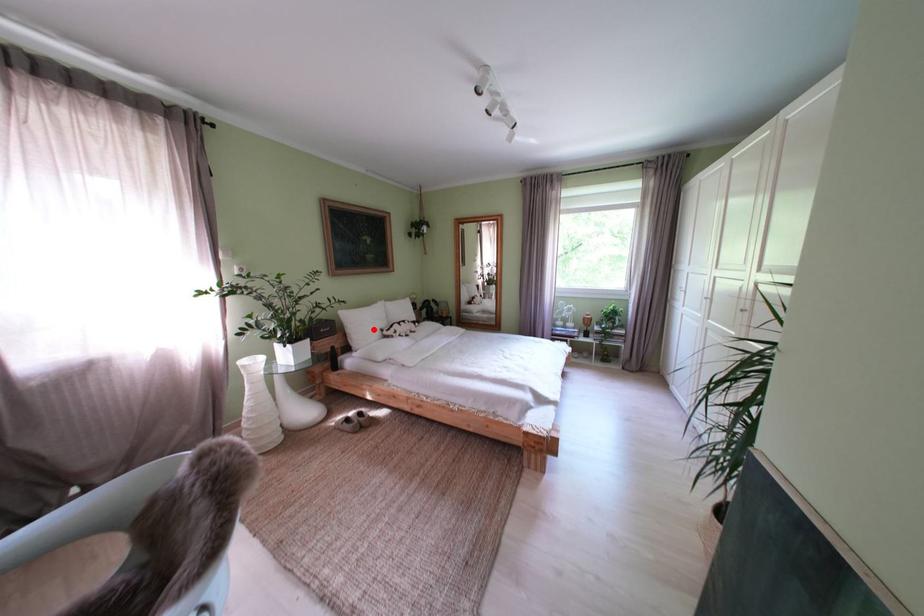
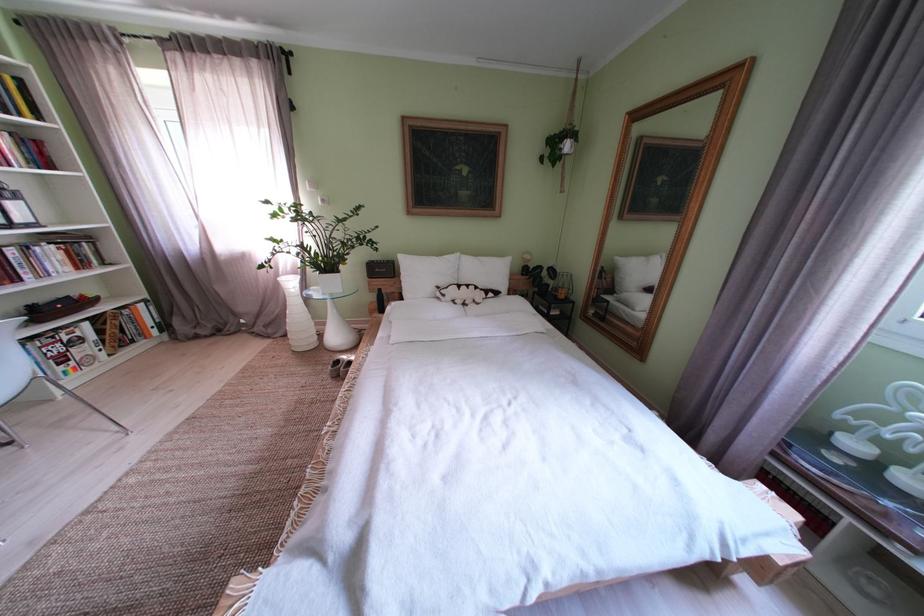
Find the pixel in the second image that matches the highlighted location in the first image.

(429, 280)